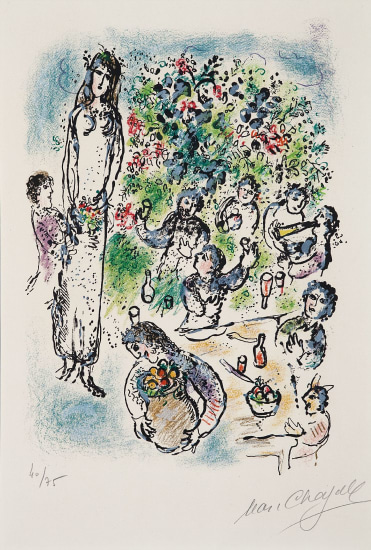
Identify the location of wine bottle on table right side. (263, 355).